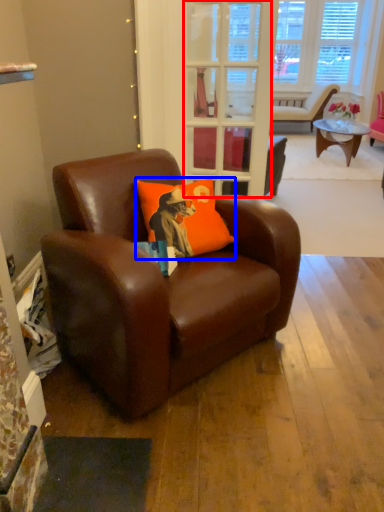
Question: Which point is closer to the camera, glass door (highlighted by a red box) or pillow (highlighted by a blue box)?

Choices:
 (A) glass door
 (B) pillow

Answer: (B)